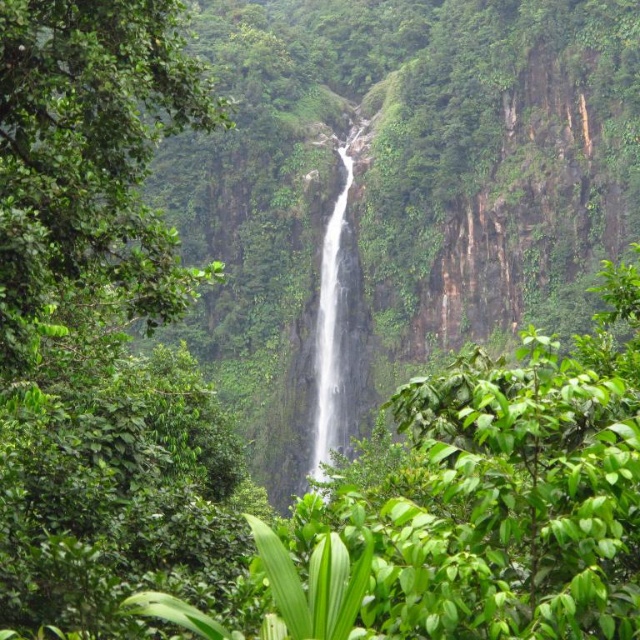
Is green leafy tree at center in front of white smooth waterfall at center?

Yes, it is.

Who is positioned more to the right, green leafy tree at center or white smooth waterfall at center?

white smooth waterfall at center

Between point (52, 32) and point (328, 284), which one is positioned in front?

Point (52, 32)

Locate an element on the screen. green leafy tree at center is located at coordinates (90, 161).